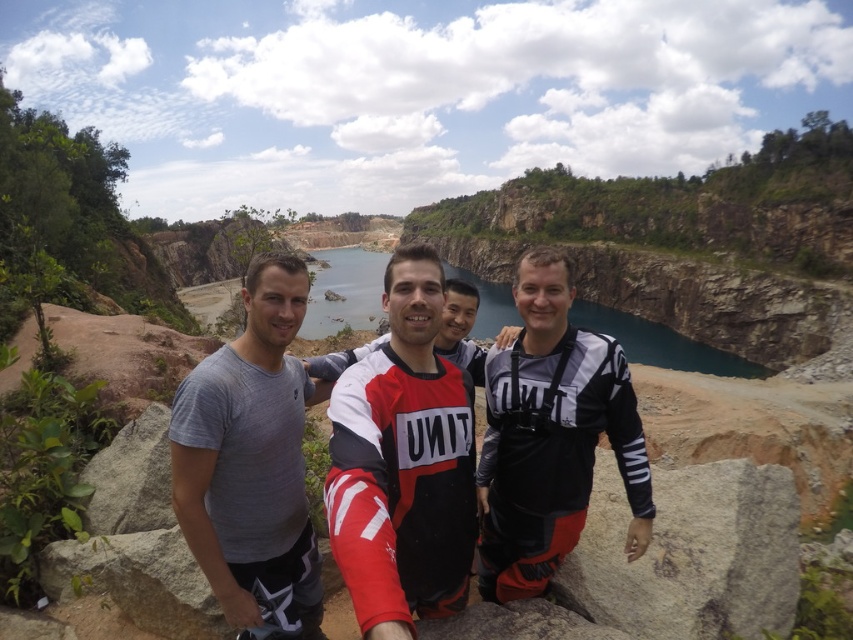
You are standing at the edge of the quarry and want to take a photo of the red and white jersey at center. Which direction should you face to ensure the jersey is in the frame?

The red and white jersey at center is located at point (403, 464), so you should face towards the center of the rocky outcrop where the group is positioned to capture the jersey in your photo.

You are part of the group in the quarry photo. You need to decide who will hold the camera higher to take a better selfie. Which person should you ask, the one wearing the red and white jersey at center or the one in the black matte wetsuit at center?

The black matte wetsuit at center is taller than the red and white jersey at center, so you should ask the person in the black matte wetsuit at center to hold the camera higher for a better selfie.

You are using a drone to capture a photo of the group at the quarry. The drone is currently at coordinates 0.6, 0.5. To ensure the red and white jersey at center is in the frame, should you move the drone north or south? Please explain your reasoning based on their positions.

The red and white jersey at center is located at point (403, 464). The drone is at (426, 384). Since the jersey is to the east and slightly south of the drone, moving the drone south would bring it closer to the jersey. Wait, actually, in coordinate systems, typically the first coordinate is x, the second is y. If the drone is at x 0.6, y 0.5, and the jersey is at x 0.725, y 0.474, then the jersey is east of the drone because x is higher, and slightly south because y is lower. So to center the jersey, the x